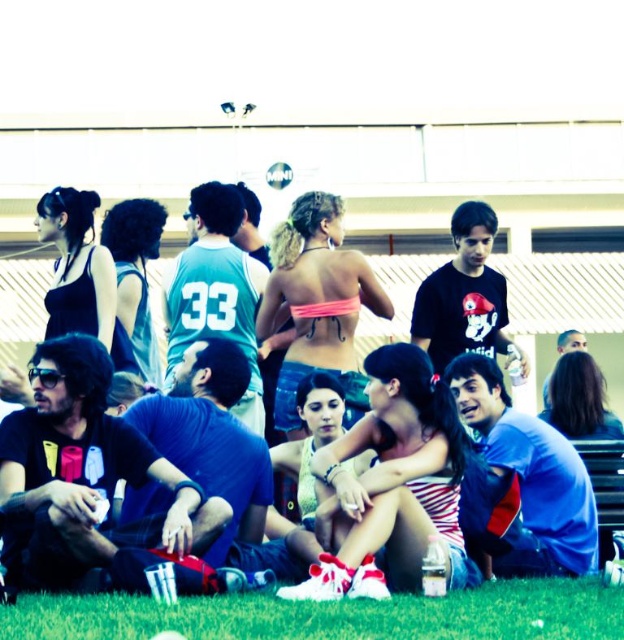
Question: Does green grass at lower center appear on the left side of matte blue shirt at center?

Choices:
 (A) no
 (B) yes

Answer: (A)

Question: In this image, where is green grass at lower center located relative to matte blue shirt at center?

Choices:
 (A) right
 (B) left

Answer: (A)

Question: Which point appears closest to the camera in this image?

Choices:
 (A) (207, 205)
 (B) (207, 637)

Answer: (B)

Question: Is green grass at lower center smaller than matte blue shirt at center?

Choices:
 (A) no
 (B) yes

Answer: (B)

Question: Which point appears farthest from the camera in this image?

Choices:
 (A) (494, 588)
 (B) (49, 204)

Answer: (B)